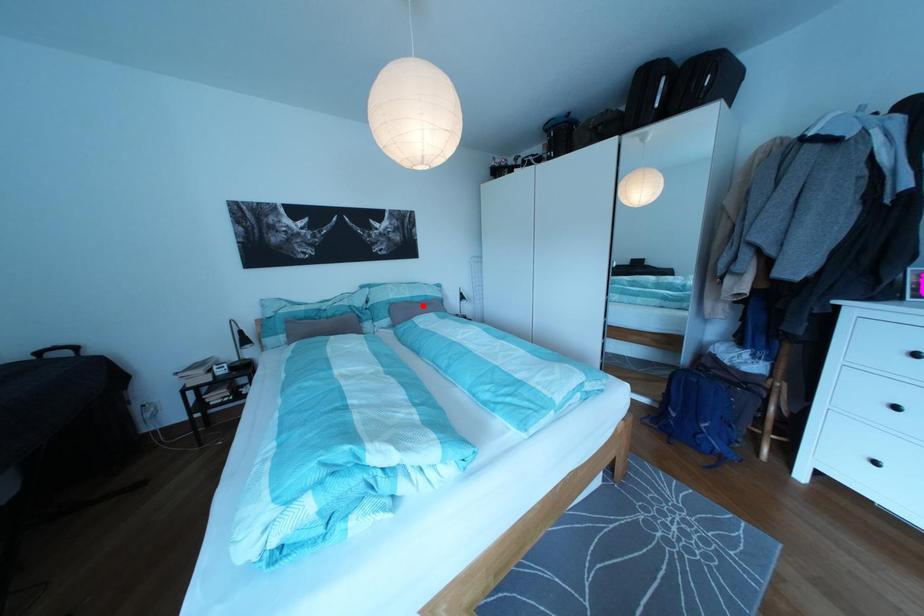
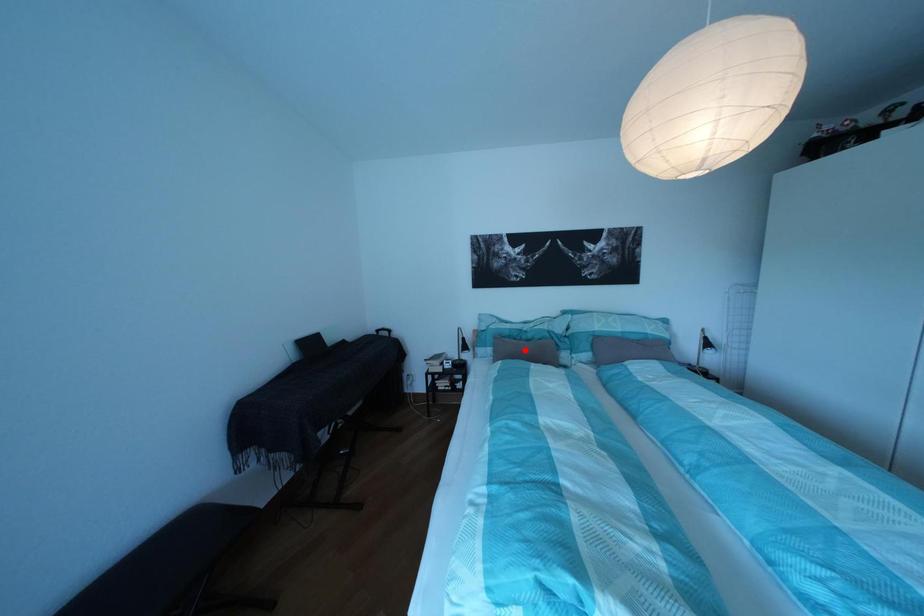
I am providing you with two images of the same scene from different viewpoints. A red point is marked on the first image and another point is marked on the second image. Are the points marked in image1 and image2 representing the same 3D position?

No